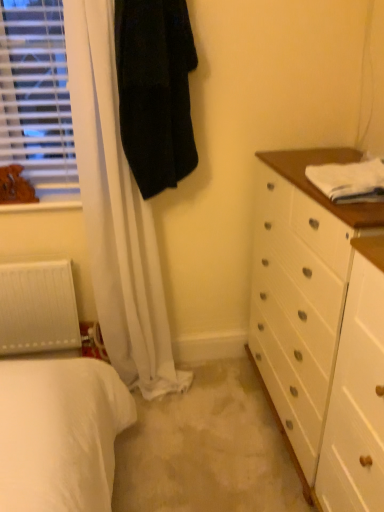
The height and width of the screenshot is (512, 384). I want to click on vacant space in black fuzzy coat at upper left (from a real-world perspective), so click(x=181, y=386).